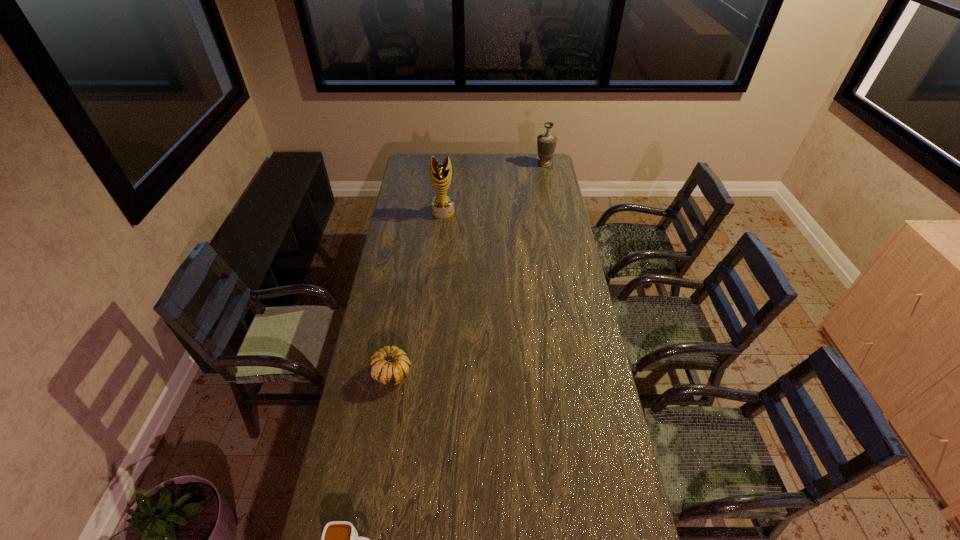
I want to click on object that is at the left edge, so (390, 365).

You are a GUI agent. You are given a task and a screenshot of the screen. Output one action in this format:
    pyautogui.click(x=<x>, y=<y>)
    Task: Click on the object present at the right edge
    The height and width of the screenshot is (540, 960).
    Given the screenshot: What is the action you would take?
    pyautogui.click(x=546, y=143)

The height and width of the screenshot is (540, 960). In order to click on object that is positioned at the far right corner in this screenshot , I will do `click(546, 143)`.

Identify the location of free space at the far edge of the desktop. The height and width of the screenshot is (540, 960). (526, 171).

The image size is (960, 540). Find the location of `free region at the left edge of the desktop`. free region at the left edge of the desktop is located at coordinates (372, 383).

Where is `free point at the right edge`? free point at the right edge is located at coordinates (550, 176).

The width and height of the screenshot is (960, 540). What are the coordinates of `blank space at the far right corner of the desktop` in the screenshot? It's located at (551, 161).

Where is `free spot between the award and the second tallest object`? This screenshot has width=960, height=540. free spot between the award and the second tallest object is located at coordinates (493, 188).

The height and width of the screenshot is (540, 960). Identify the location of free space between the award and the second shortest object. (418, 292).

Where is `vacant space in between the third tallest object and the rightmost object`? vacant space in between the third tallest object and the rightmost object is located at coordinates (468, 268).